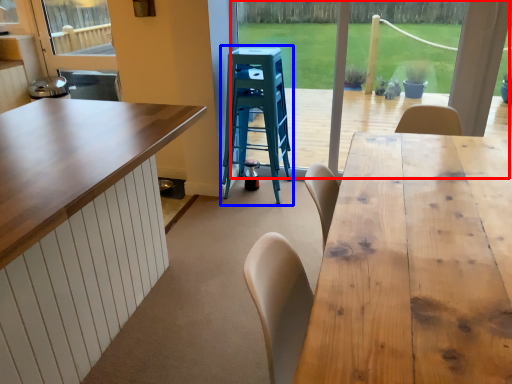
Question: Which object appears closest to the camera in this image, window frame (highlighted by a red box) or step stool (highlighted by a blue box)?

Choices:
 (A) window frame
 (B) step stool

Answer: (A)